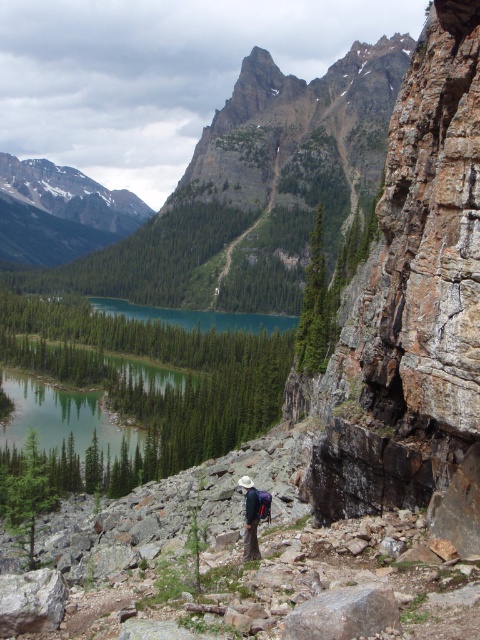
Consider the image. You are a hiker who needs to place a 15 meter long tent between the rusty brown rock at right and the dark blue fabric backpack at center. Can you fit the tent between them without overlapping either object?

The distance between the rusty brown rock at right and the dark blue fabric backpack at center is 14.62 meters. Since the tent is 15 meters long, it cannot be placed between them without overlapping one of the objects.